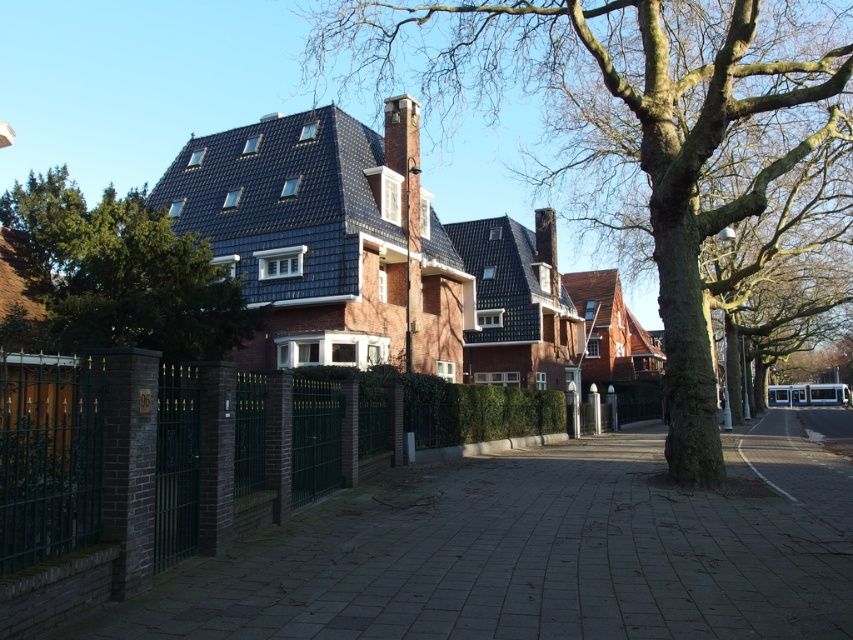
Question: In this image, where is smooth bark tree at center located relative to green leafy tree at upper left?

Choices:
 (A) above
 (B) below

Answer: (A)

Question: From the image, what is the correct spatial relationship of gray concrete pavement at lower left in relation to smooth bark tree at center?

Choices:
 (A) below
 (B) above

Answer: (A)

Question: Estimate the real-world distances between objects in this image. Which object is closer to the smooth bark tree at center?

Choices:
 (A) green leafy tree at upper left
 (B) gray concrete pavement at lower left

Answer: (B)

Question: Considering the relative positions of gray concrete pavement at lower left and smooth bark tree at center in the image provided, where is gray concrete pavement at lower left located with respect to smooth bark tree at center?

Choices:
 (A) left
 (B) right

Answer: (A)

Question: Which point is farther to the camera?

Choices:
 (A) smooth bark tree at center
 (B) gray concrete pavement at lower left

Answer: (A)

Question: Which of the following is the farthest from the observer?

Choices:
 (A) (735, 554)
 (B) (56, 308)

Answer: (B)